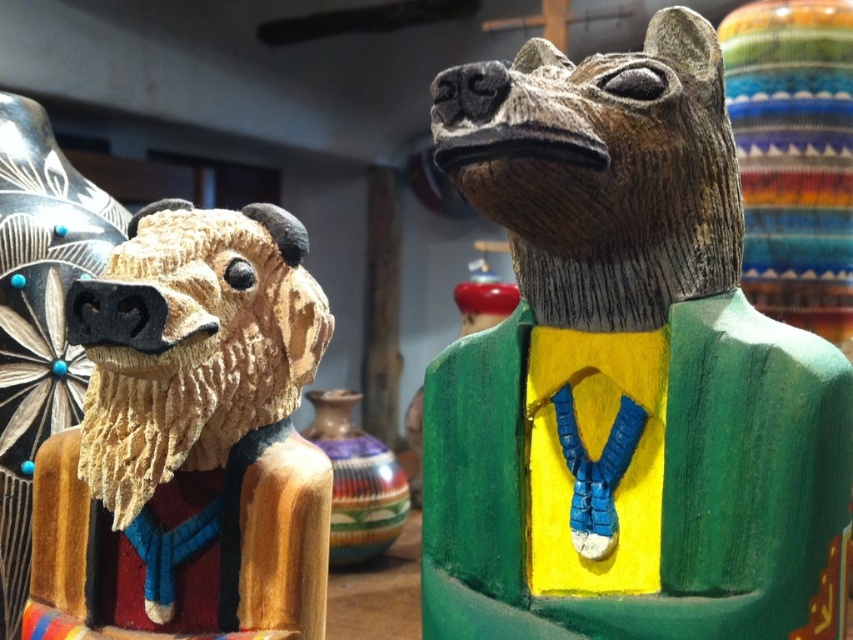
Question: Which of the following is the farthest from the observer?

Choices:
 (A) wooden bear head at left
 (B) wooden statue at right

Answer: (A)

Question: Which object is positioned closest to the wooden bear head at left?

Choices:
 (A) wooden statue at right
 (B) multicolored clay vase at center

Answer: (A)

Question: Can you confirm if wooden statue at right is positioned to the left of wooden bear head at left?

Choices:
 (A) no
 (B) yes

Answer: (A)

Question: Can you confirm if wooden bear head at left is thinner than multicolored clay vase at center?

Choices:
 (A) yes
 (B) no

Answer: (B)

Question: Can you confirm if wooden statue at right is wider than multicolored clay vase at center?

Choices:
 (A) yes
 (B) no

Answer: (A)

Question: Among these objects, which one is farthest from the camera?

Choices:
 (A) wooden bear head at left
 (B) multicolored clay vase at center
 (C) wooden statue at right

Answer: (B)